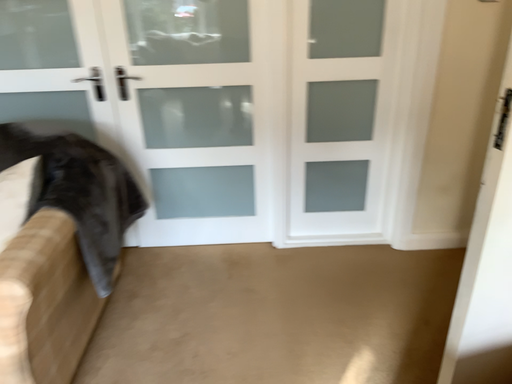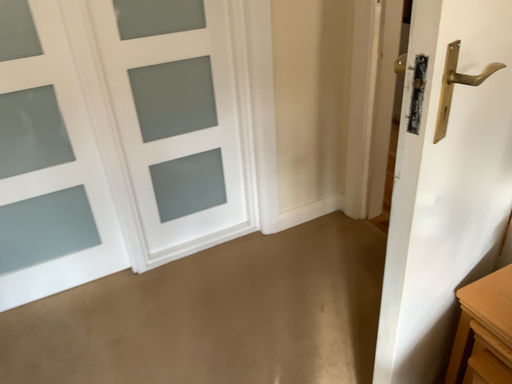
Question: How did the camera likely rotate when shooting the video?

Choices:
 (A) rotated left
 (B) rotated right

Answer: (B)